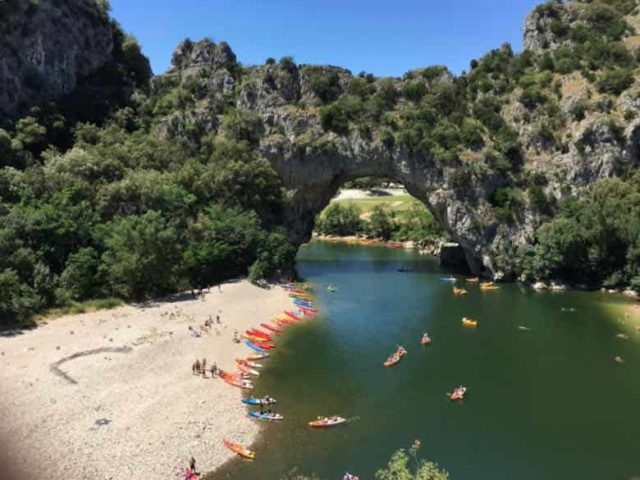
Where is `archway`? archway is located at coordinates coord(374,169).